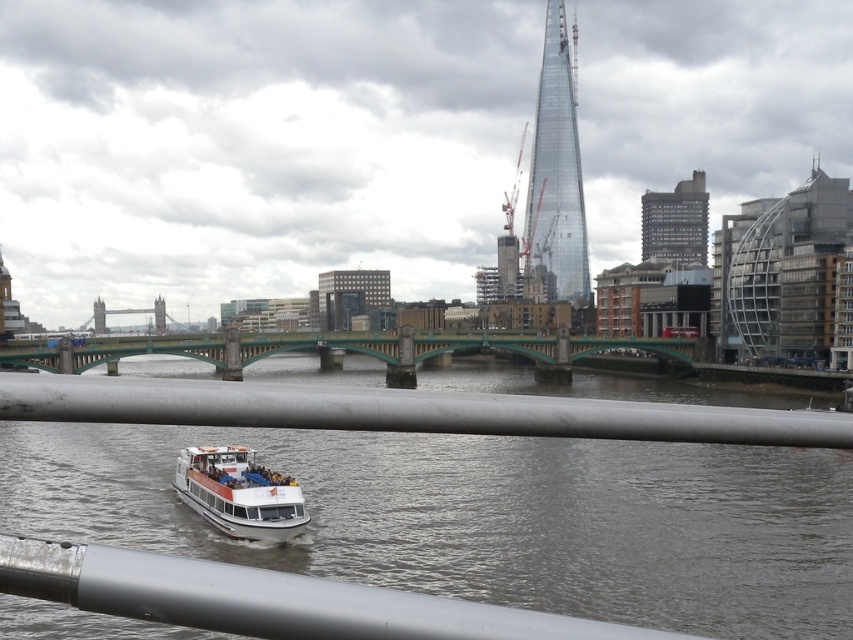
How much distance is there between glassy modern building at right and transparent glass tower at upper center?

A distance of 150.77 meters exists between glassy modern building at right and transparent glass tower at upper center.

Based on the photo, is glassy modern building at right wider than transparent glass tower at upper center?

In fact, glassy modern building at right might be narrower than transparent glass tower at upper center.

What do you see at coordinates (780, 272) in the screenshot? The height and width of the screenshot is (640, 853). I see `glassy modern building at right` at bounding box center [780, 272].

You are a GUI agent. You are given a task and a screenshot of the screen. Output one action in this format:
    pyautogui.click(x=<x>, y=<y>)
    Task: Click on the glassy modern building at right
    The width and height of the screenshot is (853, 640).
    Given the screenshot: What is the action you would take?
    pyautogui.click(x=780, y=272)

Is white matte water at center thinner than gray concrete building at center?

Incorrect, white matte water at center's width is not less than gray concrete building at center's.

Between point (554, 440) and point (370, 308), which one is positioned in front?

Point (554, 440)

Is point (554, 529) closer to camera compared to point (352, 276)?

Yes, it is in front of point (352, 276).

The image size is (853, 640). I want to click on white matte water at center, so click(x=485, y=518).

Does dark gray concrete building at upper right have a lesser width compared to gray concrete building at center?

No, dark gray concrete building at upper right is not thinner than gray concrete building at center.

Between dark gray concrete building at upper right and gray concrete building at center, which one appears on the left side from the viewer's perspective?

Positioned to the left is gray concrete building at center.

Where is `dark gray concrete building at upper right`? Image resolution: width=853 pixels, height=640 pixels. dark gray concrete building at upper right is located at coordinates (676, 221).